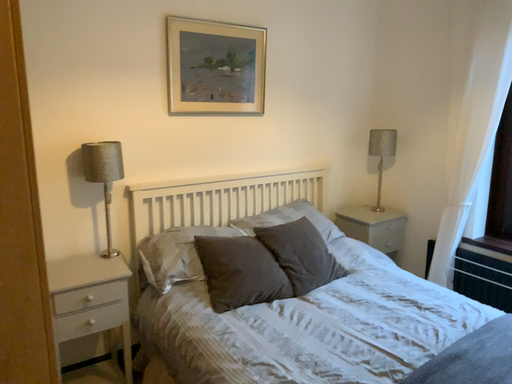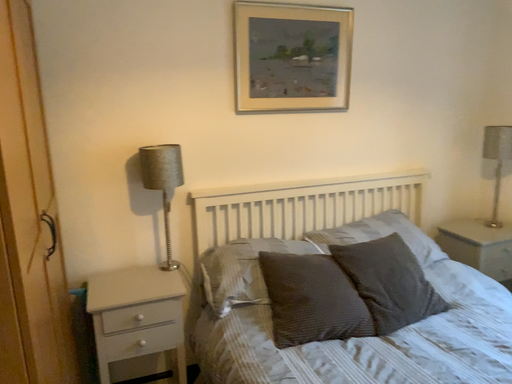
Question: How did the camera likely rotate when shooting the video?

Choices:
 (A) rotated right
 (B) rotated left

Answer: (B)